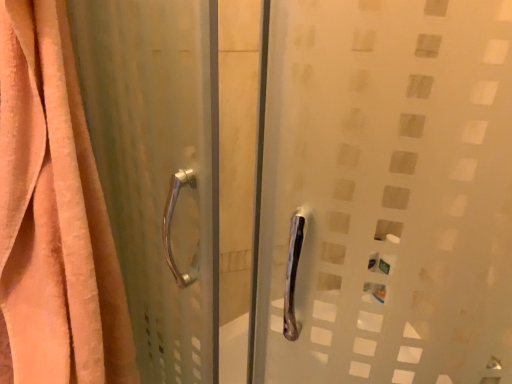
Question: From a real-world perspective, is satin silver handle at left physically above orange velvety curtain at left?

Choices:
 (A) yes
 (B) no

Answer: (B)

Question: Can you confirm if satin silver handle at left is taller than orange velvety curtain at left?

Choices:
 (A) no
 (B) yes

Answer: (B)

Question: From the image's perspective, is satin silver handle at left over orange velvety curtain at left?

Choices:
 (A) no
 (B) yes

Answer: (A)

Question: Is satin silver handle at left behind orange velvety curtain at left?

Choices:
 (A) yes
 (B) no

Answer: (B)

Question: Is satin silver handle at left next to orange velvety curtain at left?

Choices:
 (A) yes
 (B) no

Answer: (B)

Question: Can you confirm if satin silver handle at left is thinner than orange velvety curtain at left?

Choices:
 (A) yes
 (B) no

Answer: (A)

Question: Is orange velvety curtain at left with satin silver handle at left?

Choices:
 (A) no
 (B) yes

Answer: (A)

Question: Is orange velvety curtain at left smaller than satin silver handle at left?

Choices:
 (A) no
 (B) yes

Answer: (B)

Question: From the image's perspective, does orange velvety curtain at left appear higher than satin silver handle at left?

Choices:
 (A) yes
 (B) no

Answer: (A)

Question: Does orange velvety curtain at left contain satin silver handle at left?

Choices:
 (A) yes
 (B) no

Answer: (B)

Question: Is orange velvety curtain at left facing away from satin silver handle at left?

Choices:
 (A) no
 (B) yes

Answer: (A)

Question: From a real-world perspective, is orange velvety curtain at left physically below satin silver handle at left?

Choices:
 (A) no
 (B) yes

Answer: (A)

Question: From a real-world perspective, is orange velvety curtain at left above or below satin silver handle at left?

Choices:
 (A) above
 (B) below

Answer: (A)